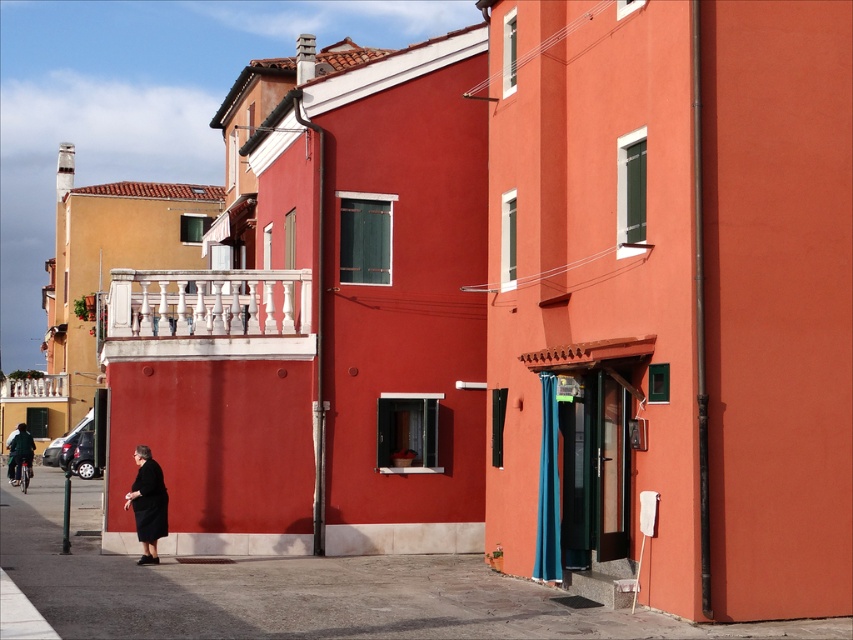
Question: Can you confirm if black matte dress at lower left is positioned to the right of white marble balcony at upper left?

Choices:
 (A) yes
 (B) no

Answer: (A)

Question: Estimate the real-world distances between objects in this image. Which object is closer to the dark green fabric jacket at lower left?

Choices:
 (A) white marble balcony at upper left
 (B) black matte dress at lower left

Answer: (B)

Question: Can you confirm if smooth concrete pavement at lower center is smaller than dark green fabric jacket at lower left?

Choices:
 (A) no
 (B) yes

Answer: (A)

Question: Among these points, which one is nearest to the camera?

Choices:
 (A) (161, 536)
 (B) (247, 291)

Answer: (A)

Question: Can you confirm if smooth concrete pavement at lower center is positioned below black matte dress at lower left?

Choices:
 (A) yes
 (B) no

Answer: (A)

Question: Which of the following is the farthest from the observer?

Choices:
 (A) (201, 289)
 (B) (138, 484)
 (C) (19, 385)
 (D) (451, 586)

Answer: (C)